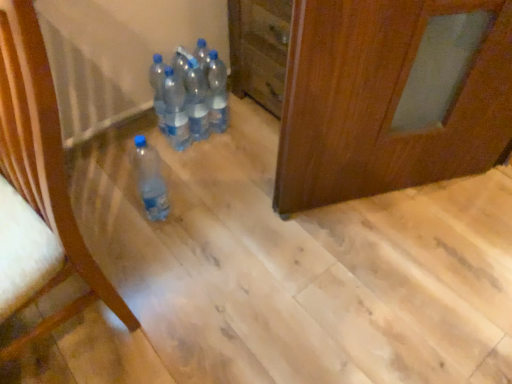
Where is `vacant area that lies between clear plastic bottle at left and transparent plastic bottles at center, the 3th bottle in the right-to-left sequence`? This screenshot has width=512, height=384. vacant area that lies between clear plastic bottle at left and transparent plastic bottles at center, the 3th bottle in the right-to-left sequence is located at coordinates (142, 222).